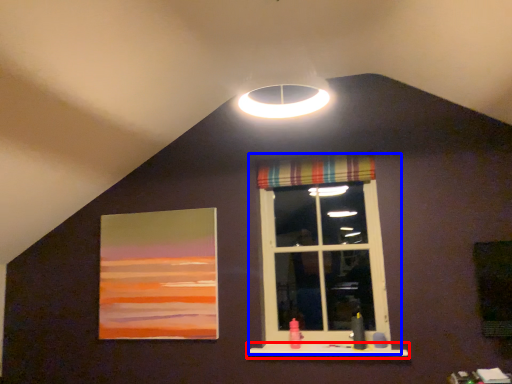
Question: Which point is further to the camera, window sill (highlighted by a red box) or window (highlighted by a blue box)?

Choices:
 (A) window sill
 (B) window

Answer: (B)